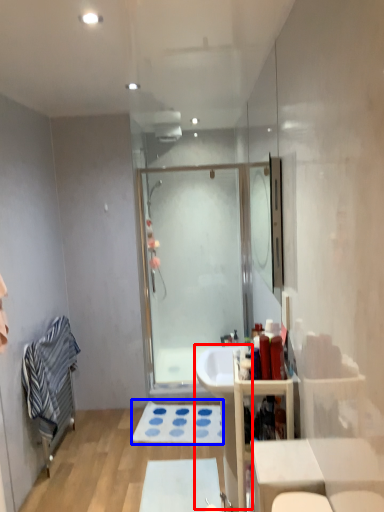
Question: Which of the following is the closest to the observer, sink (highlighted by a red box) or bath mat (highlighted by a blue box)?

Choices:
 (A) sink
 (B) bath mat

Answer: (A)